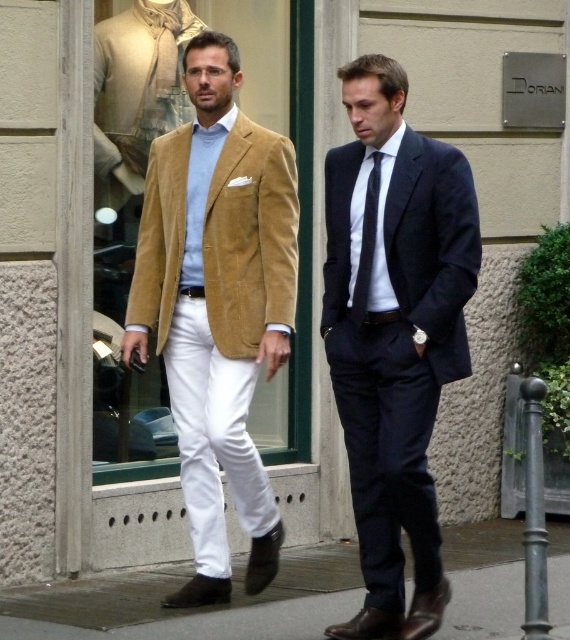
You are a fashion designer analyzing a photo of two men. The first man is wearing a light brown corduroy blazer, and the second man is in a dark navy suit. There is a point marked at coordinates (217, 305) in the image. Which object does this point correspond to?

The point at coordinates (217, 305) corresponds to the velvet gold blazer at center.

You are a photographer trying to capture both the matte navy suit at right and the smooth concrete pavement at lower center in a single frame. Based on their sizes, which object should you focus on first to ensure both are clearly visible in the photo?

The matte navy suit at right is bigger than the smooth concrete pavement at lower center, so you should focus on the matte navy suit at right first to ensure both are clearly visible in the photo.

You are a photographer trying to capture a closeup of the dark blue silk tie at center without including the velvet gold blazer at center in the frame. Based on their positions, is this possible?

The velvet gold blazer at center is to the left of dark blue silk tie at center, so if you position your camera to the right side of the dark blue silk tie at center and zoom in, you can capture the dark blue silk tie at center without including the velvet gold blazer at center in the frame.